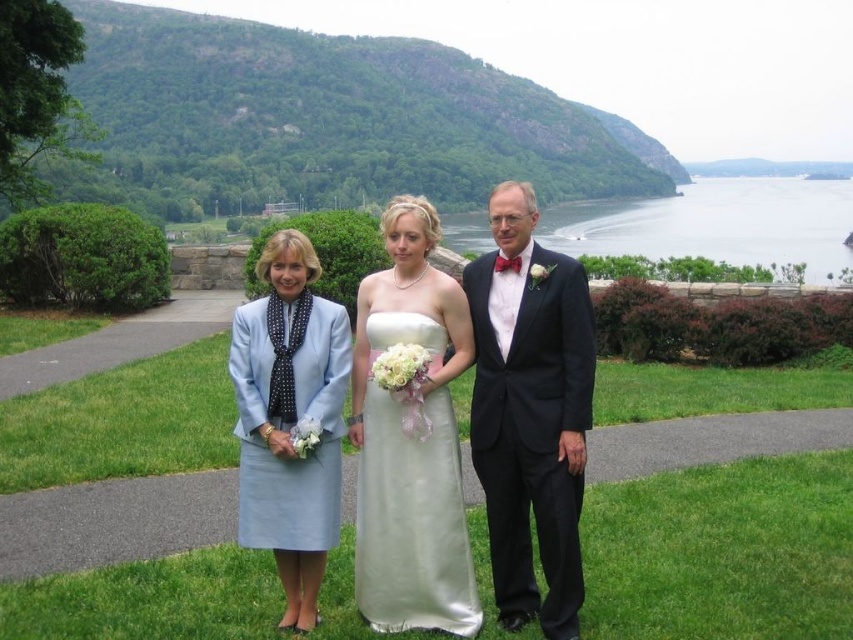
Question: Which object is the farthest from the light blue fabric dress at center?

Choices:
 (A) black satin suit at center
 (B) clear blue water at upper center
 (C) satin white dress at center

Answer: (B)

Question: Which object appears farthest from the camera in this image?

Choices:
 (A) light blue fabric dress at center
 (B) clear blue water at upper center

Answer: (B)

Question: Which object appears farthest from the camera in this image?

Choices:
 (A) satin white dress at center
 (B) clear blue water at upper center
 (C) white satin dress at center

Answer: (B)

Question: Can you confirm if white satin dress at center is wider than satin white dress at center?

Choices:
 (A) yes
 (B) no

Answer: (A)

Question: Where is white satin dress at center located in relation to black satin suit at center in the image?

Choices:
 (A) left
 (B) right

Answer: (A)

Question: Can you confirm if black satin suit at center is wider than clear blue water at upper center?

Choices:
 (A) yes
 (B) no

Answer: (B)